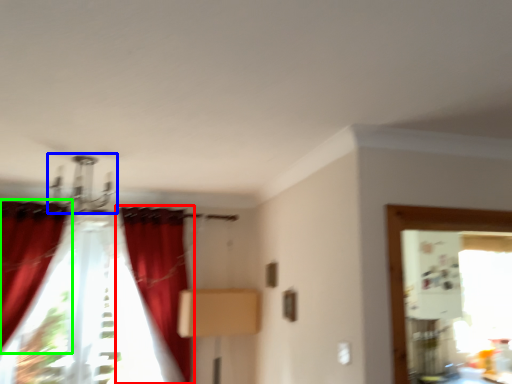
Question: Which object is the closest to the curtain (highlighted by a red box)? Choose among these: light fixture (highlighted by a blue box) or curtain (highlighted by a green box).

Choices:
 (A) light fixture
 (B) curtain

Answer: (A)